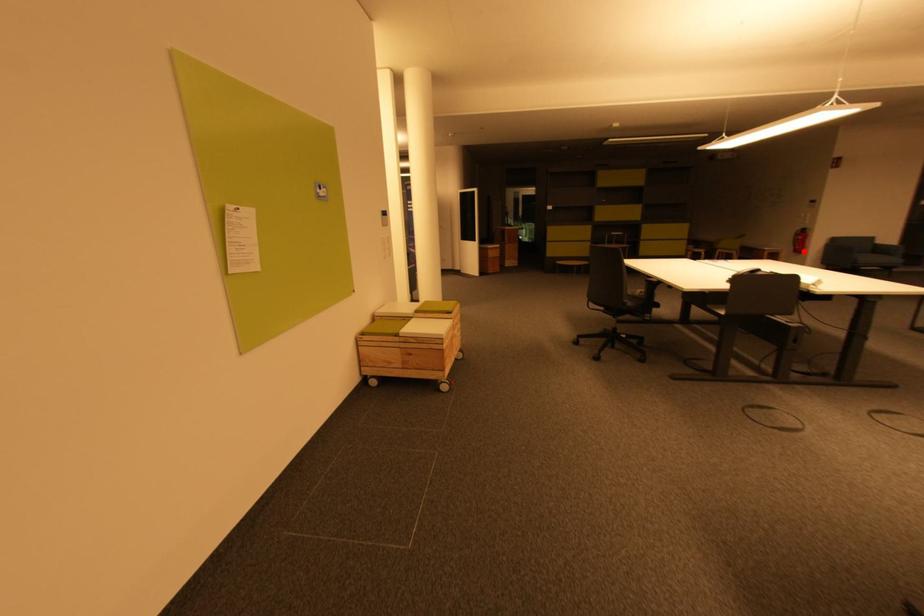
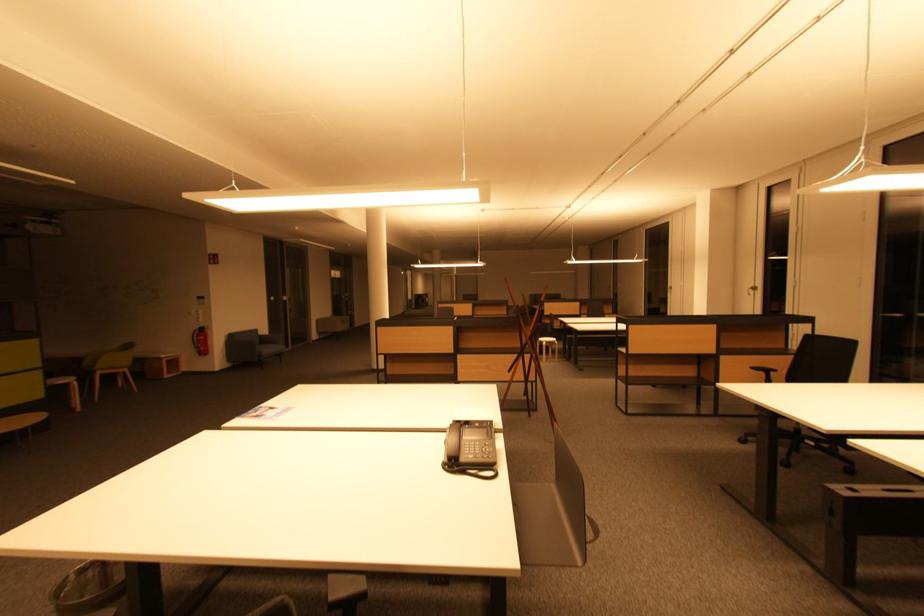
Question: I am providing you with two images of the same scene from different viewpoints. In image1, a red point is highlighted. Considering the same 3D point in image2, which of the following is correct?

Choices:
 (A) It is closer
 (B) It is farther

Answer: (A)